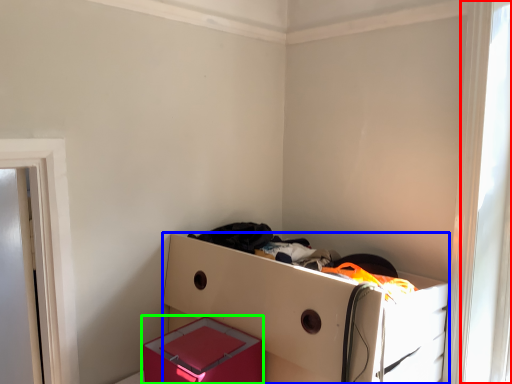
Question: Considering the real-world distances, which object is closest to window (highlighted by a red box)? furniture (highlighted by a blue box) or box (highlighted by a green box).

Choices:
 (A) furniture
 (B) box

Answer: (A)